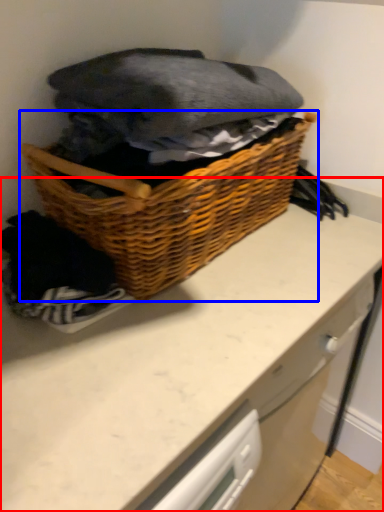
Question: Which point is further to the camera, counter (highlighted by a red box) or picnic basket (highlighted by a blue box)?

Choices:
 (A) counter
 (B) picnic basket

Answer: (A)